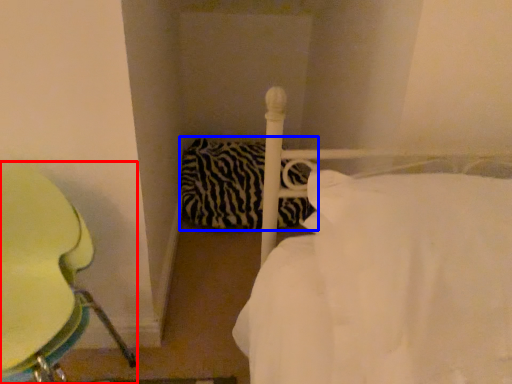
Question: Which of the following is the closest to the observer, furniture (highlighted by a red box) or pillow (highlighted by a blue box)?

Choices:
 (A) furniture
 (B) pillow

Answer: (A)